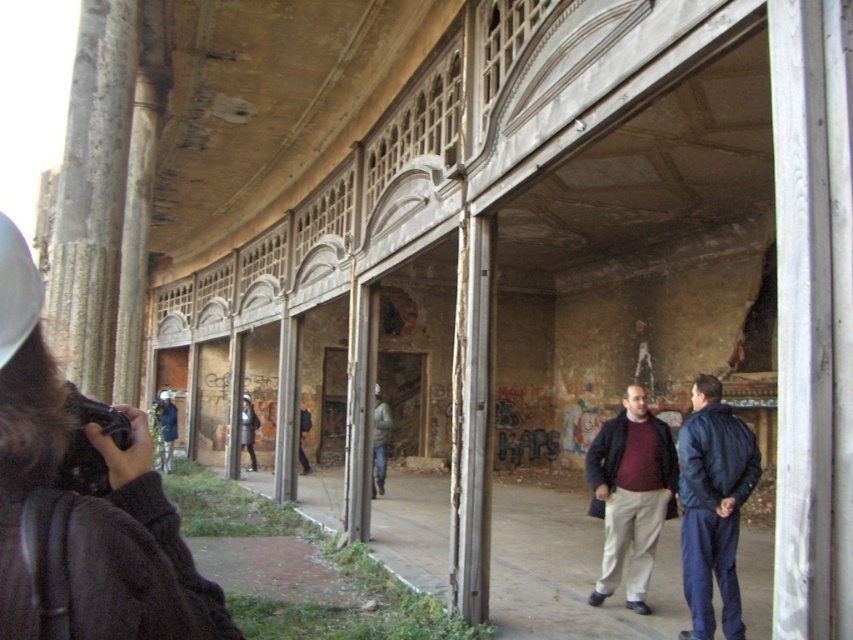
Looking at this image, you are standing at the point marked as point (184, 589) in an abandoned building. You want to take a photo of the camera holder who is 5.44 feet away from you. Is the camera holder within your camera lens range if your camera can capture up to 10 feet?

The camera holder is 5.44 feet away from point (184, 589), which is within the camera lens range of 10 feet. Therefore, the camera holder can be captured in the photo.